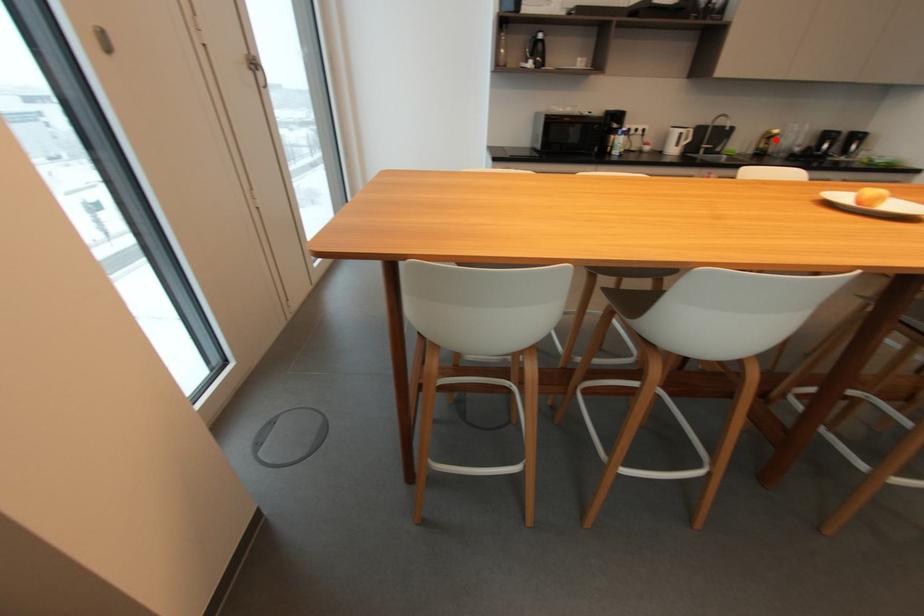
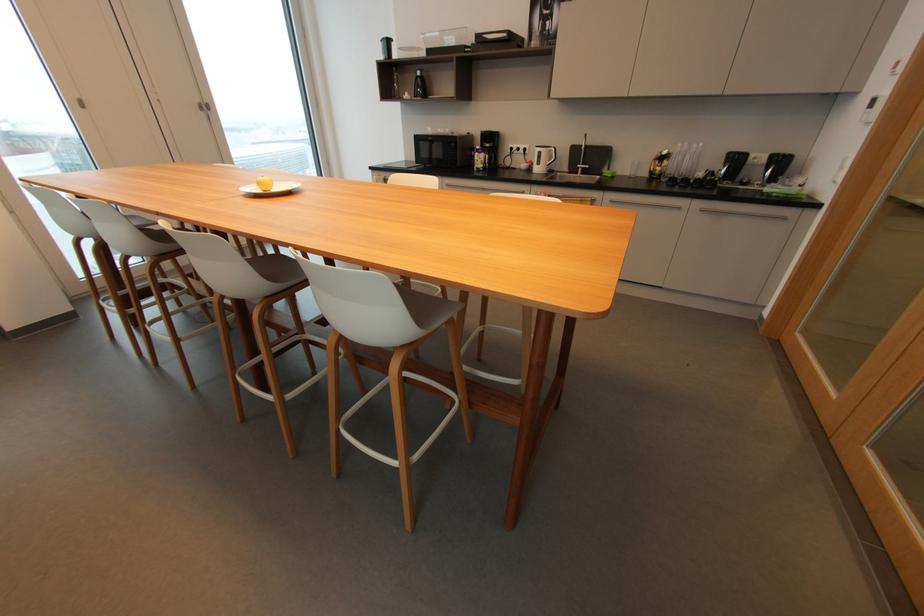
Question: I am providing you with two images of the same scene from different viewpoints. In image1, a red point is highlighted. Considering the same 3D point in image2, which of the following is correct?

Choices:
 (A) It is closer
 (B) It is farther

Answer: (A)